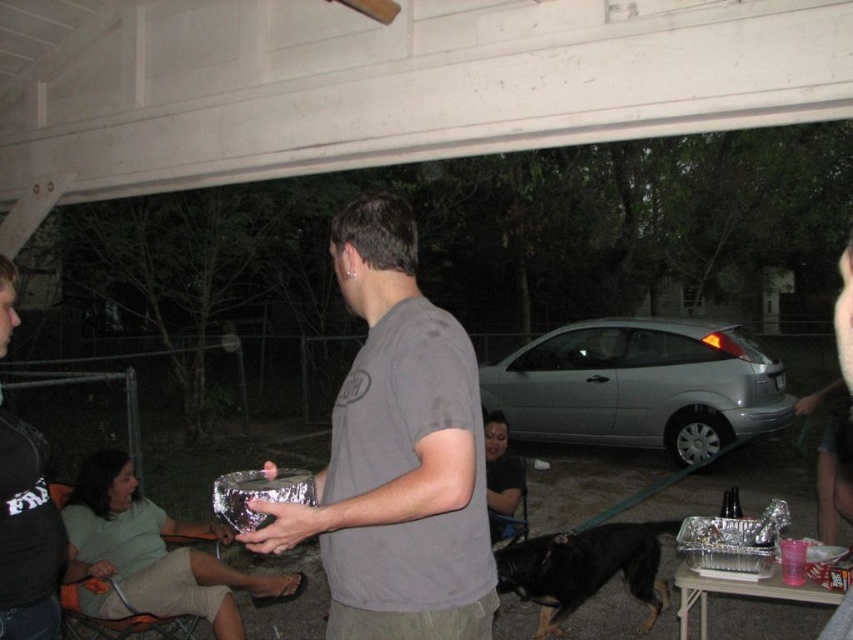
Question: Can you confirm if gray matte t-shirt at center is bigger than silver metallic car at center?

Choices:
 (A) yes
 (B) no

Answer: (B)

Question: Can you confirm if gray matte t-shirt at center is positioned below black fur dog at lower center?

Choices:
 (A) no
 (B) yes

Answer: (A)

Question: Among these points, which one is farthest from the camera?

Choices:
 (A) (572, 588)
 (B) (473, 433)
 (C) (611, 328)

Answer: (C)

Question: Which point is closer to the camera?

Choices:
 (A) black fur dog at lower center
 (B) gray matte t-shirt at center
 (C) silver metallic car at center

Answer: (B)

Question: Is silver metallic car at center positioned at the back of black fur dog at lower center?

Choices:
 (A) yes
 (B) no

Answer: (A)

Question: Which point is farther to the camera?

Choices:
 (A) (599, 328)
 (B) (451, 378)

Answer: (A)